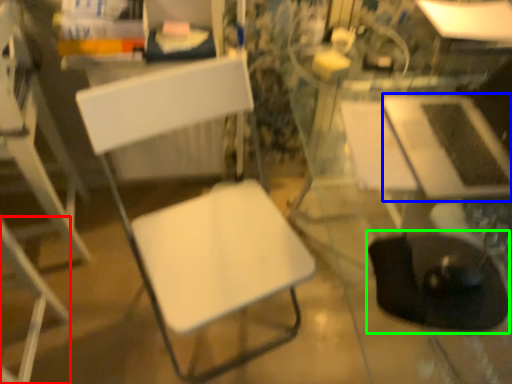
Question: Based on their relative distances, which object is nearer to chair (highlighted by a red box)? Choose from table (highlighted by a blue box) and swivel chair (highlighted by a green box).

Choices:
 (A) table
 (B) swivel chair

Answer: (B)